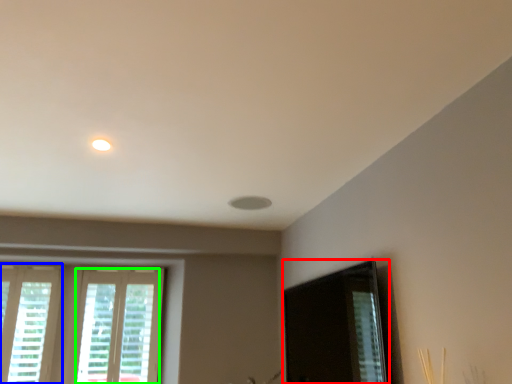
Question: Based on their relative distances, which object is farther from screen door (highlighted by a red box)? Choose from window (highlighted by a blue box) and window (highlighted by a green box).

Choices:
 (A) window
 (B) window

Answer: (A)